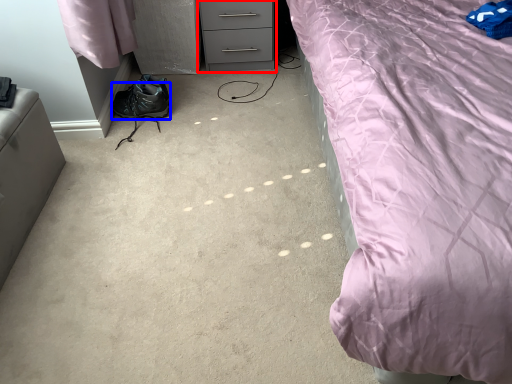
Question: Which of the following is the farthest to the observer, chest of drawers (highlighted by a red box) or shoe (highlighted by a blue box)?

Choices:
 (A) chest of drawers
 (B) shoe

Answer: (A)